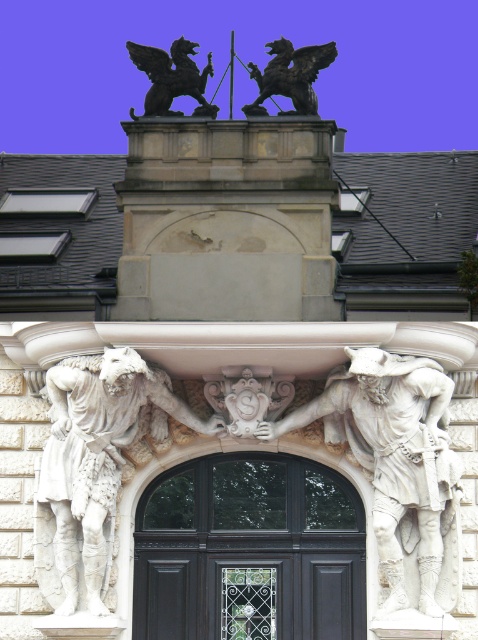
Can you confirm if black wood door at center is wider than white marble warrior at center?

Yes, black wood door at center is wider than white marble warrior at center.

Measure the distance between black wood door at center and camera.

85.36 meters

I want to click on black wood door at center, so click(249, 552).

Is black wood door at center positioned in front of white marble statue at center?

No, it is behind white marble statue at center.

Is point (143, 595) positioned after point (84, 444)?

Yes, point (143, 595) is behind point (84, 444).

Is point (223, 540) closer to camera compared to point (53, 518)?

No, it is behind (53, 518).

Locate an element on the screen. The image size is (478, 640). black wood door at center is located at coordinates (249, 552).

Can you confirm if black stone griffin at upper center is taller than dark brown stone gargoyle at upper center?

Yes, black stone griffin at upper center is taller than dark brown stone gargoyle at upper center.

Who is more forward, (176, 67) or (286, 80)?

Point (286, 80)

Image resolution: width=478 pixels, height=640 pixels. Describe the element at coordinates (173, 76) in the screenshot. I see `black stone griffin at upper center` at that location.

You are a GUI agent. You are given a task and a screenshot of the screen. Output one action in this format:
    pyautogui.click(x=<x>, y=<y>)
    Task: Click on the black stone griffin at upper center
    Image resolution: width=478 pixels, height=640 pixels.
    Given the screenshot: What is the action you would take?
    pyautogui.click(x=173, y=76)